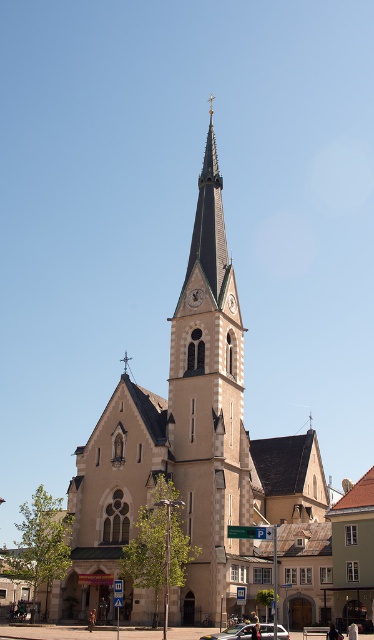
What do you see at coordinates (188, 449) in the screenshot? The height and width of the screenshot is (640, 374). I see `beige stone church at center` at bounding box center [188, 449].

Is beige stone church at center positioned behind silver metallic car at center?

Yes.

Is point (310, 618) closer to viewer compared to point (262, 627)?

No, (310, 618) is behind (262, 627).

The height and width of the screenshot is (640, 374). In order to click on beige stone church at center in this screenshot , I will do [188, 449].